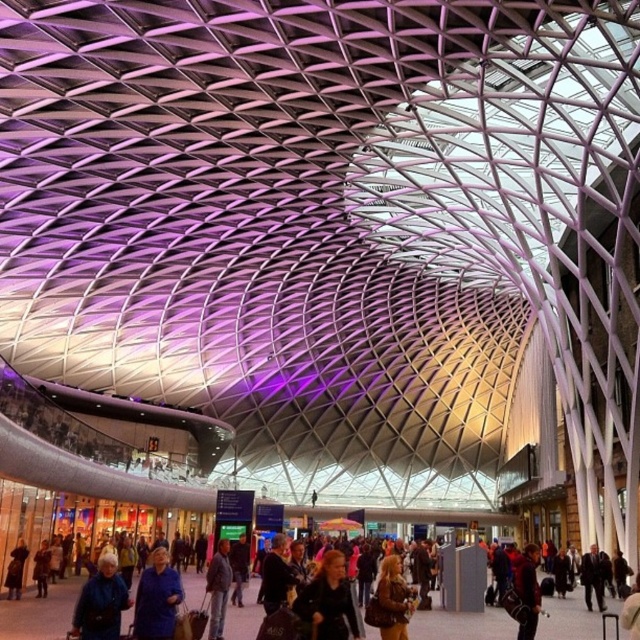
Between point (33, 632) and point (344, 624), which one is positioned behind?

The point (33, 632) is behind.

Is dark blue jacket at center above matte black jacket at lower center?

No.

Identify the location of dark blue jacket at center. The height and width of the screenshot is (640, 640). (38, 612).

Is matte blue jacket at lower left wider than brown leather jacket at center?

Yes.

Can you confirm if matte blue jacket at lower left is smaller than brown leather jacket at center?

Incorrect, matte blue jacket at lower left is not smaller in size than brown leather jacket at center.

Locate an element on the screen. matte blue jacket at lower left is located at coordinates (100, 602).

Which of these two, dark blue jacket at center or dark blue shirt at center, stands shorter?

Standing shorter between the two is dark blue shirt at center.

Which is behind, point (60, 611) or point (212, 557)?

The point (212, 557) is behind.

Image resolution: width=640 pixels, height=640 pixels. Find the location of `dark blue jacket at center`. dark blue jacket at center is located at coordinates (38, 612).

This screenshot has height=640, width=640. Find the location of `dark blue jacket at center`. dark blue jacket at center is located at coordinates (38, 612).